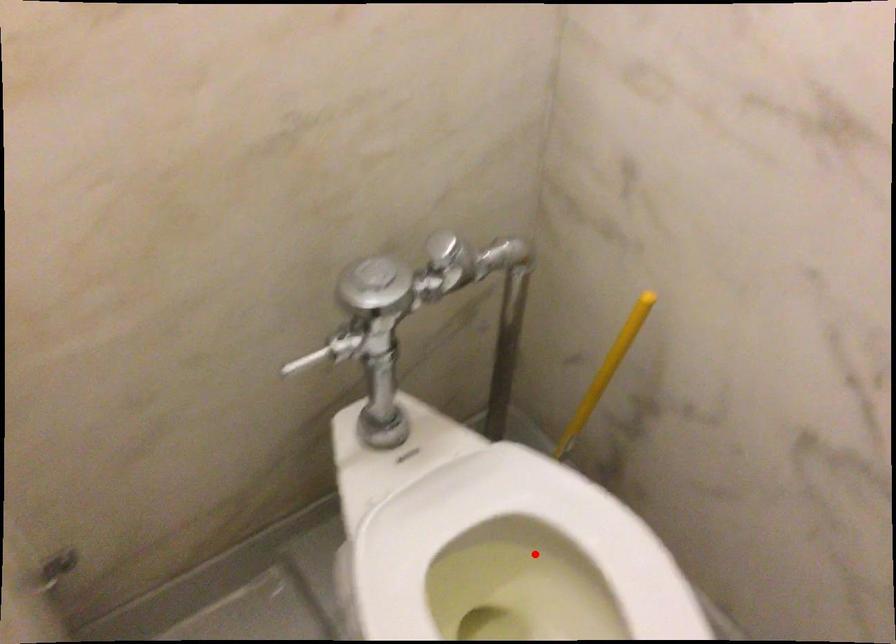
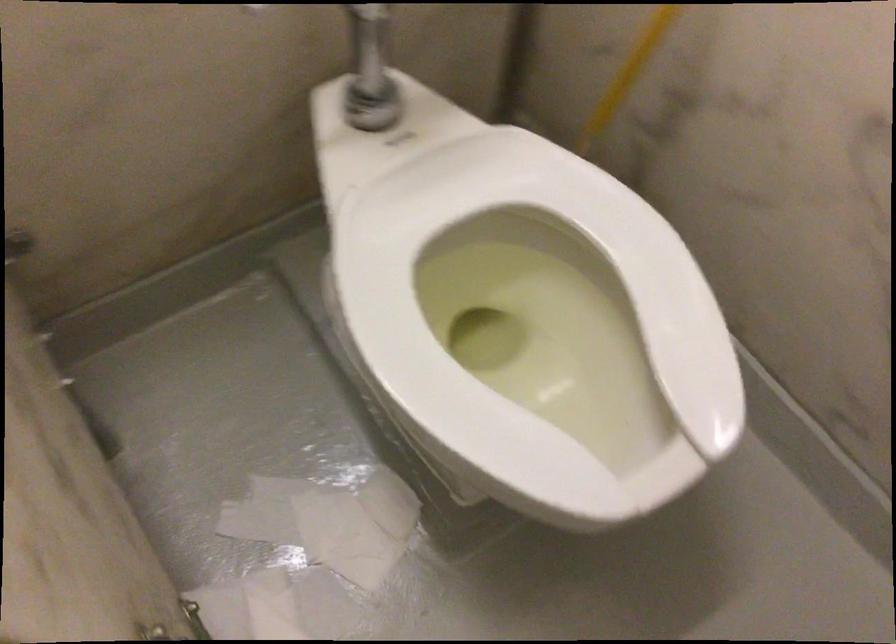
The point at the highlighted location is marked in the first image. Where is the corresponding point in the second image?

(536, 254)